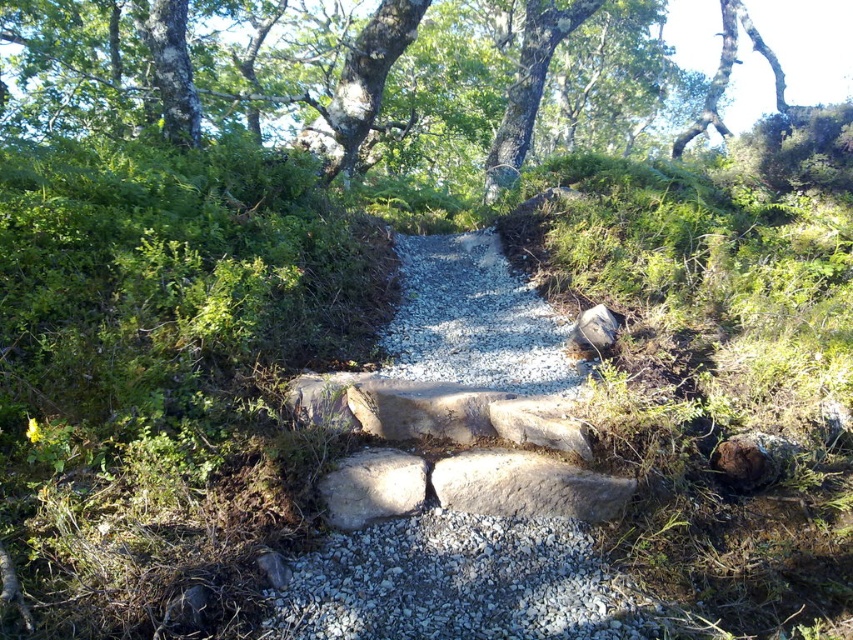
Question: Which point is farther to the camera?

Choices:
 (A) rough bark tree at upper center
 (B) gray gravel at center
 (C) smooth gray rock at center-right

Answer: (A)

Question: Is rough bark tree at upper center above gray rough stone at center?

Choices:
 (A) no
 (B) yes

Answer: (B)

Question: Observing the image, what is the correct spatial positioning of gray gravel at center in reference to smooth gray rock at center-right?

Choices:
 (A) left
 (B) right

Answer: (A)

Question: Which object is farther from the camera taking this photo?

Choices:
 (A) rough bark tree at upper center
 (B) gray rough stone at center
 (C) smooth gray rock at center-right
 (D) gray gravel at center

Answer: (A)

Question: Which object is farther from the camera taking this photo?

Choices:
 (A) gray gravel at center
 (B) gray rough stone at center

Answer: (B)

Question: Does gray gravel at center have a lesser width compared to smooth gray rock at center-right?

Choices:
 (A) yes
 (B) no

Answer: (B)